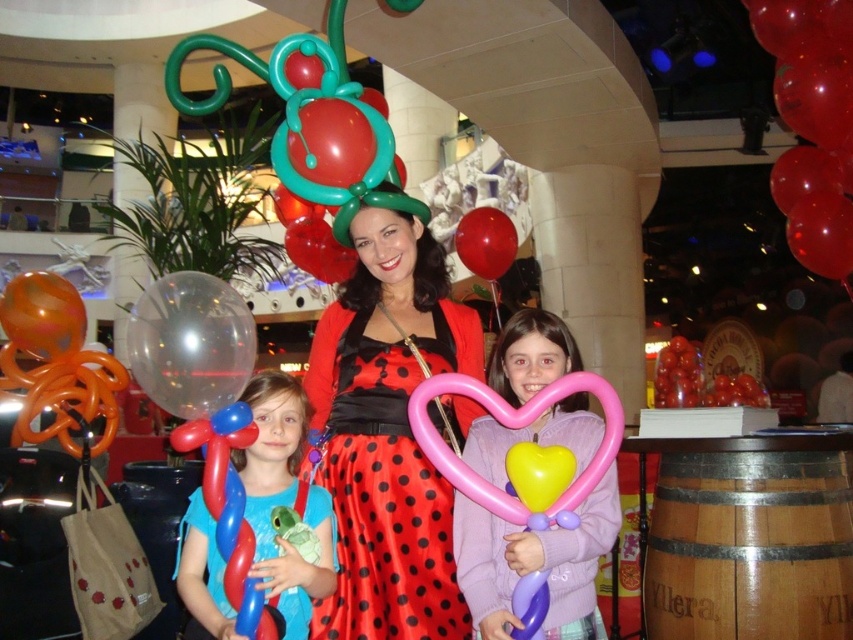
Does blue rubber balloon at left have a larger size compared to shiny metallic balloon at center?

Yes, blue rubber balloon at left is bigger than shiny metallic balloon at center.

Who is higher up, blue rubber balloon at left or shiny metallic balloon at center?

Positioned higher is shiny metallic balloon at center.

Which is behind, point (285, 493) or point (456, 250)?

The point (456, 250) is more distant.

I want to click on blue rubber balloon at left, so click(283, 500).

Is point (521, 499) positioned after point (468, 216)?

No, it is in front of (468, 216).

From the picture: Between yellow rubber heart at lower center and shiny metallic balloon at center, which one has less height?

yellow rubber heart at lower center

Does point (566, 484) lie in front of point (502, 257)?

Yes, point (566, 484) is closer to viewer.

Where is `yellow rubber heart at lower center`? Image resolution: width=853 pixels, height=640 pixels. yellow rubber heart at lower center is located at coordinates (538, 474).

Based on the photo, is transparent plastic balloon at left wider than shiny metallic balloon at center?

No.

Who is taller, transparent plastic balloon at left or shiny metallic balloon at center?

shiny metallic balloon at center is taller.

Describe the element at coordinates (190, 342) in the screenshot. I see `transparent plastic balloon at left` at that location.

You are a GUI agent. You are given a task and a screenshot of the screen. Output one action in this format:
    pyautogui.click(x=<x>, y=<y>)
    Task: Click on the transparent plastic balloon at left
    The image size is (853, 640).
    Given the screenshot: What is the action you would take?
    pyautogui.click(x=190, y=342)